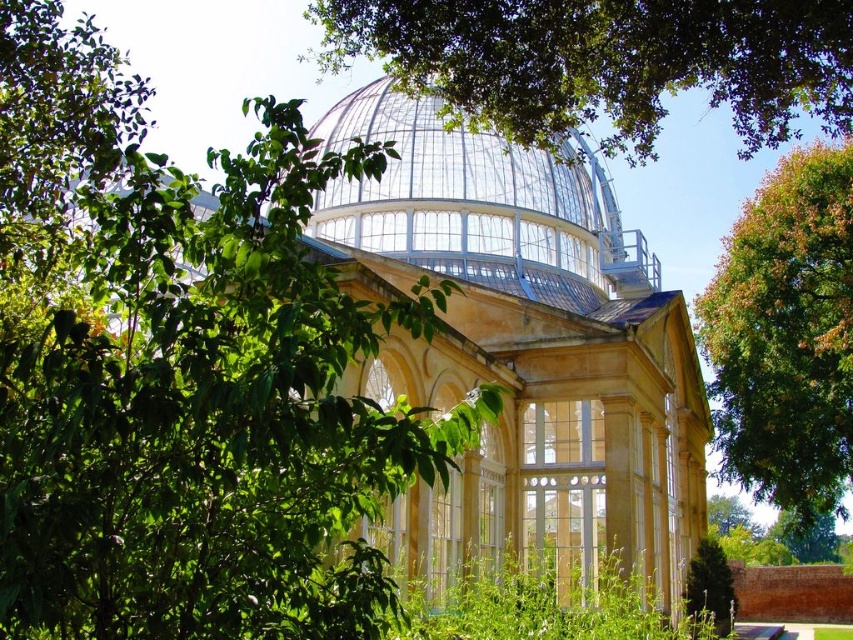
Question: Among these points, which one is nearest to the camera?

Choices:
 (A) (827, 282)
 (B) (665, 113)
 (C) (323, 125)
 (D) (477, 134)

Answer: (B)

Question: Can you confirm if green leafy tree at upper center is bigger than green leafy tree at right?

Choices:
 (A) yes
 (B) no

Answer: (A)

Question: Does clear glass dome at center come in front of green leafy tree at right?

Choices:
 (A) yes
 (B) no

Answer: (A)

Question: Is matte glass dome at center further to camera compared to green leafy tree at upper center?

Choices:
 (A) no
 (B) yes

Answer: (A)

Question: Which point is farther to the camera?

Choices:
 (A) green leafy tree at upper center
 (B) green leafy tree at right
 (C) matte glass dome at center

Answer: (B)

Question: Which of the following is the closest to the observer?

Choices:
 (A) clear glass dome at center
 (B) green leafy tree at upper center
 (C) matte glass dome at center
 (D) green leafy tree at right

Answer: (C)